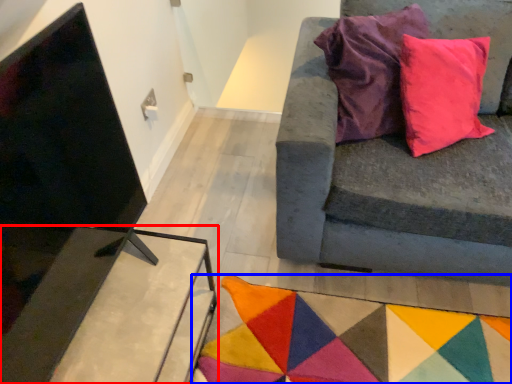
Question: Which object is further to the camera taking this photo, table (highlighted by a red box) or mat (highlighted by a blue box)?

Choices:
 (A) table
 (B) mat

Answer: (B)